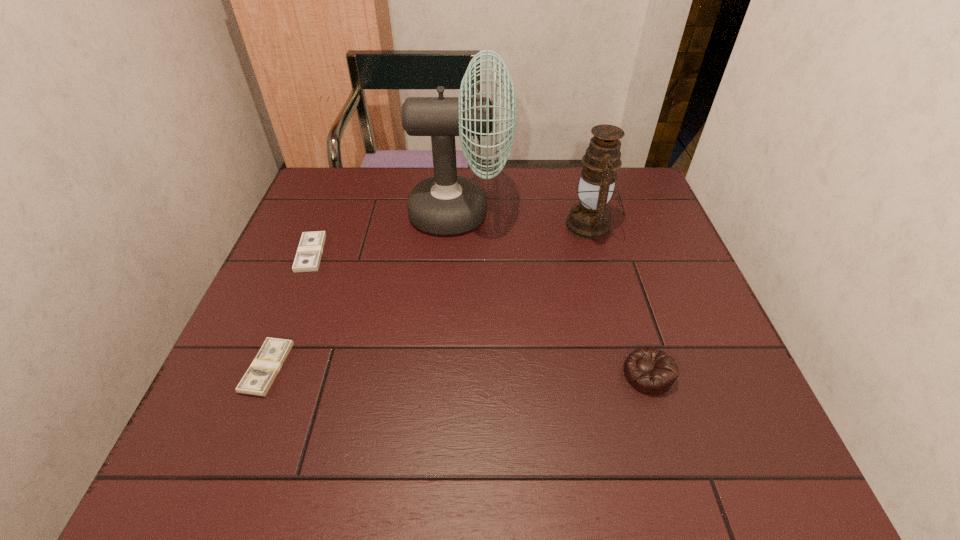
Where is `vacant space at the far left corner of the desktop`? The image size is (960, 540). vacant space at the far left corner of the desktop is located at coordinates (363, 191).

Identify the location of blank space at the far right corner. The height and width of the screenshot is (540, 960). 618,192.

In the image, there is a desktop. Where is `vacant space at the near right corner`? vacant space at the near right corner is located at coordinates (692, 460).

Find the location of a particular element. The width and height of the screenshot is (960, 540). empty space between the third object from left to right and the oil lamp is located at coordinates (525, 219).

Where is `free space between the nearer dollar and the fan`? free space between the nearer dollar and the fan is located at coordinates (364, 290).

You are a GUI agent. You are given a task and a screenshot of the screen. Output one action in this format:
    pyautogui.click(x=<x>, y=<y>)
    Task: Click on the free point between the oil lamp and the nearer dollar
    
    Given the screenshot: What is the action you would take?
    pyautogui.click(x=429, y=296)

Locate an element on the screen. This screenshot has width=960, height=540. vacant space in between the nearer dollar and the oil lamp is located at coordinates (429, 296).

Find the location of a particular element. The height and width of the screenshot is (540, 960). vacant space that's between the nearer dollar and the oil lamp is located at coordinates (429, 296).

Locate an element on the screen. This screenshot has height=540, width=960. unoccupied area between the farther dollar and the tallest object is located at coordinates (385, 233).

At what (x,y) coordinates should I click in order to perform the action: click on free space between the farther dollar and the nearer dollar. Please return your answer as a coordinate pair (x, y). This screenshot has height=540, width=960. Looking at the image, I should click on (289, 310).